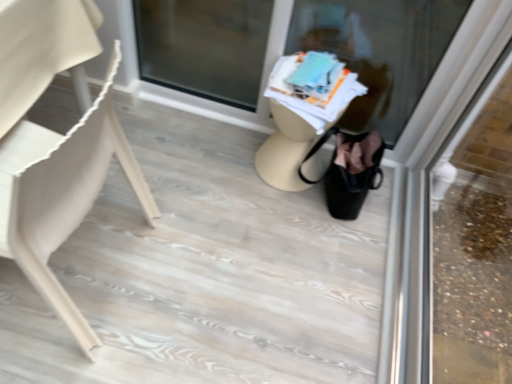
What are the coordinates of `free space behind matte beige chair at left` in the screenshot? It's located at (167, 157).